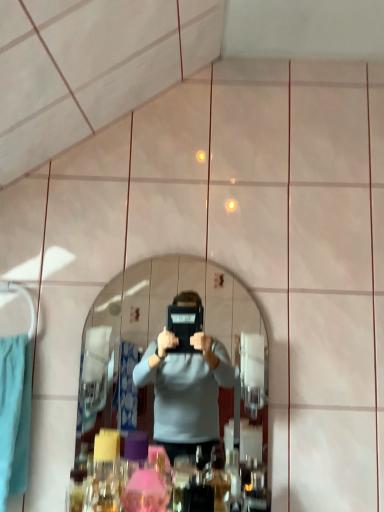
Question: Is clear glass mirror at center to the left or to the right of teal towel at left in the image?

Choices:
 (A) right
 (B) left

Answer: (A)

Question: From a real-world perspective, is clear glass mirror at center positioned above or below teal towel at left?

Choices:
 (A) above
 (B) below

Answer: (A)

Question: Considering their positions, is clear glass mirror at center located in front of or behind teal towel at left?

Choices:
 (A) front
 (B) behind

Answer: (B)

Question: From the image's perspective, is teal towel at left above or below clear glass mirror at center?

Choices:
 (A) above
 (B) below

Answer: (B)

Question: Considering the positions of point (13, 433) and point (183, 422), is point (13, 433) closer or farther from the camera than point (183, 422)?

Choices:
 (A) closer
 (B) farther

Answer: (A)

Question: Is teal towel at left wider or thinner than clear glass mirror at center?

Choices:
 (A) wide
 (B) thin

Answer: (A)

Question: From a real-world perspective, is teal towel at left positioned above or below clear glass mirror at center?

Choices:
 (A) above
 (B) below

Answer: (B)